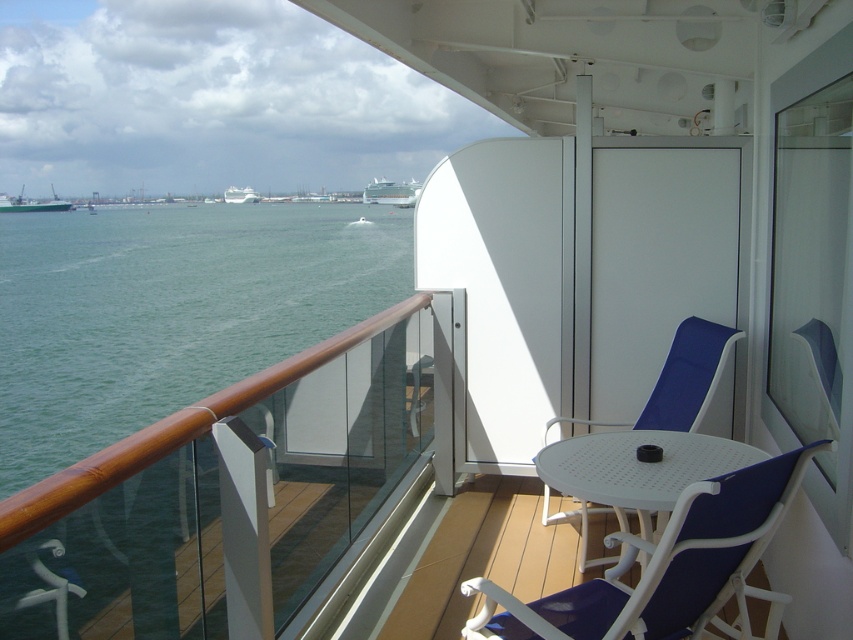
You are standing on the balcony of a cruise ship and see the white plastic beach chair at center and the white glossy cruise ship at upper center. Which object is positioned higher from the ground?

The white glossy cruise ship at upper center is positioned higher from the ground than the white plastic beach chair at center.

You are a passenger on the cruise ship and want to compare the sizes of the ships visible from your balcony. Which ship has a smaller width between the white glossy cruise ship at upper center and the green matte cargo ship at left?

The white glossy cruise ship at upper center has a smaller width compared to the green matte cargo ship at left according to the description.